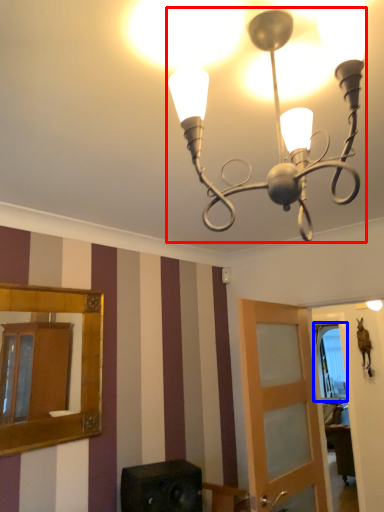
Question: Which of the following is the farthest to the observer, lamp (highlighted by a red box) or window (highlighted by a blue box)?

Choices:
 (A) lamp
 (B) window

Answer: (B)